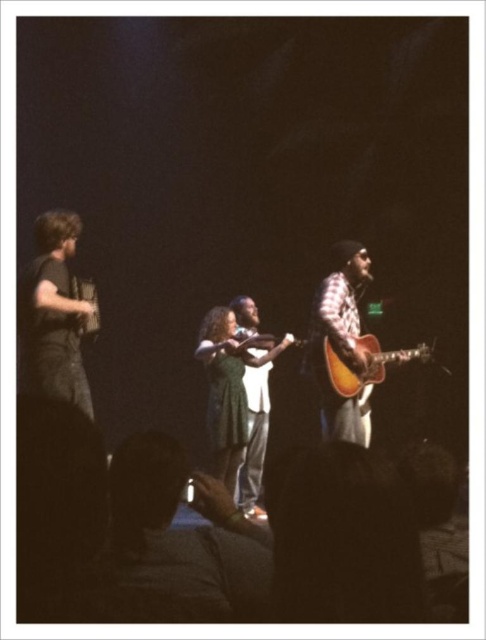
Question: Which of the following is the farthest from the observer?

Choices:
 (A) (81, 305)
 (B) (345, 276)

Answer: (B)

Question: Which object appears farthest from the camera in this image?

Choices:
 (A) dark gray t-shirt at left
 (B) acoustic wood guitar at center
 (C) plaid fabric guitar at center

Answer: (B)

Question: Is dark gray t-shirt at left positioned before plaid fabric guitar at center?

Choices:
 (A) no
 (B) yes

Answer: (B)

Question: Can you confirm if plaid fabric guitar at center is wider than acoustic wood guitar at center?

Choices:
 (A) no
 (B) yes

Answer: (A)

Question: Does dark gray t-shirt at left appear under acoustic wood guitar at center?

Choices:
 (A) yes
 (B) no

Answer: (B)

Question: Based on their relative distances, which object is nearer to the acoustic wood guitar at center?

Choices:
 (A) plaid fabric guitar at center
 (B) dark gray t-shirt at left

Answer: (A)